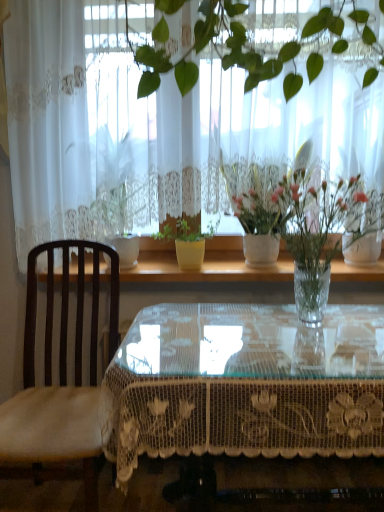
Question: Is white lace curtain at upper center bigger than transparent lace-covered table at center?

Choices:
 (A) no
 (B) yes

Answer: (A)

Question: Is white lace curtain at upper center not close to transparent lace-covered table at center?

Choices:
 (A) no
 (B) yes

Answer: (A)

Question: From the image's perspective, is white lace curtain at upper center above transparent lace-covered table at center?

Choices:
 (A) yes
 (B) no

Answer: (A)

Question: Is white lace curtain at upper center wider than transparent lace-covered table at center?

Choices:
 (A) yes
 (B) no

Answer: (B)

Question: Does white lace curtain at upper center have a greater height compared to transparent lace-covered table at center?

Choices:
 (A) yes
 (B) no

Answer: (A)

Question: From the image's perspective, is white glossy pot at center, which ranks as the 2th houseplant in right-to-left order, located above or below white ceramic vase at upper center, the 1th houseplant when ordered from right to left?

Choices:
 (A) above
 (B) below

Answer: (A)

Question: Does point (112, 211) appear closer or farther from the camera than point (281, 226)?

Choices:
 (A) closer
 (B) farther

Answer: (B)

Question: From a real-world perspective, is white glossy pot at center, which ranks as the 2th houseplant in right-to-left order, physically located above or below white ceramic vase at upper center, the 1th houseplant when ordered from right to left?

Choices:
 (A) below
 (B) above

Answer: (B)

Question: Considering the positions of white glossy pot at center, which ranks as the 2th houseplant in right-to-left order, and white ceramic vase at upper center, the 1th houseplant when ordered from right to left, in the image, is white glossy pot at center, which ranks as the 2th houseplant in right-to-left order, wider or thinner than white ceramic vase at upper center, the 1th houseplant when ordered from right to left,?

Choices:
 (A) wide
 (B) thin

Answer: (A)

Question: Considering the relative positions of white lace curtain at upper center and white glossy pot at center, acting as the 1th houseplant starting from the left, in the image provided, is white lace curtain at upper center to the left or to the right of white glossy pot at center, acting as the 1th houseplant starting from the left,?

Choices:
 (A) left
 (B) right

Answer: (B)

Question: Looking at their shapes, would you say white lace curtain at upper center is wider or thinner than white glossy pot at center, acting as the 1th houseplant starting from the left?

Choices:
 (A) thin
 (B) wide

Answer: (A)

Question: From the image's perspective, is white lace curtain at upper center positioned above or below white glossy pot at center, acting as the 1th houseplant starting from the left?

Choices:
 (A) above
 (B) below

Answer: (A)

Question: Looking at the image, does white lace curtain at upper center seem bigger or smaller compared to white glossy pot at center, acting as the 1th houseplant starting from the left?

Choices:
 (A) small
 (B) big

Answer: (B)

Question: In terms of size, does dark wood chair at left appear bigger or smaller than white ceramic vase at upper center, which is the 2th houseplant from left to right?

Choices:
 (A) big
 (B) small

Answer: (A)

Question: Choose the correct answer: Is dark wood chair at left inside white ceramic vase at upper center, the 1th houseplant when ordered from right to left, or outside it?

Choices:
 (A) outside
 (B) inside

Answer: (A)